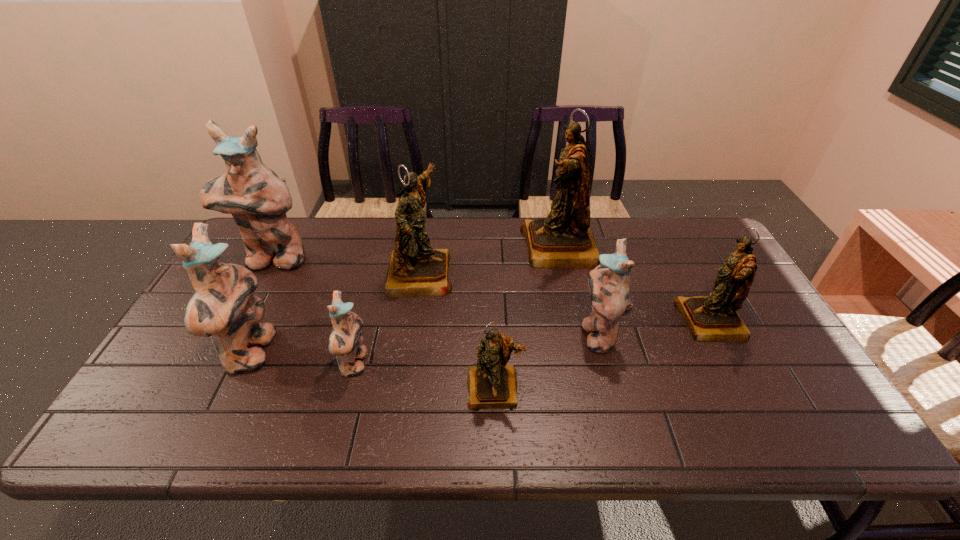
At what (x,y) coordinates should I click in order to perform the action: click on free spot between the third biggest gold figurine and the farthest pink figurine. Please return your answer as a coordinate pair (x, y). The width and height of the screenshot is (960, 540). Looking at the image, I should click on (492, 291).

You are a GUI agent. You are given a task and a screenshot of the screen. Output one action in this format:
    pyautogui.click(x=<x>, y=<y>)
    Task: Click on the free space between the smallest pink figurine and the biggest pink figurine
    The height and width of the screenshot is (540, 960).
    Given the screenshot: What is the action you would take?
    pyautogui.click(x=314, y=312)

Where is `empty space that is in between the second pink figurine from right to left and the second biggest pink figurine`? The height and width of the screenshot is (540, 960). empty space that is in between the second pink figurine from right to left and the second biggest pink figurine is located at coordinates (303, 359).

This screenshot has width=960, height=540. Find the location of `blank region between the fifth figurine from left to right and the third smallest pink figurine`. blank region between the fifth figurine from left to right and the third smallest pink figurine is located at coordinates (373, 370).

The height and width of the screenshot is (540, 960). In order to click on free space between the biggest pink figurine and the nearest gold figurine in this screenshot , I will do `click(384, 325)`.

The height and width of the screenshot is (540, 960). Identify the location of unoccupied position between the second gold figurine from right to left and the second biggest gold figurine. (490, 260).

The width and height of the screenshot is (960, 540). What are the coordinates of `empty location between the second biggest pink figurine and the smallest pink figurine` in the screenshot? It's located at (303, 359).

Find the location of a particular element. This screenshot has height=540, width=960. free space between the rightmost pink figurine and the third smallest pink figurine is located at coordinates (424, 343).

The width and height of the screenshot is (960, 540). Identify the location of free area in between the third pink figurine from left to right and the second biggest gold figurine. (388, 318).

Where is `free space that is in between the biggest gold figurine and the third smallest pink figurine`? This screenshot has width=960, height=540. free space that is in between the biggest gold figurine and the third smallest pink figurine is located at coordinates (405, 300).